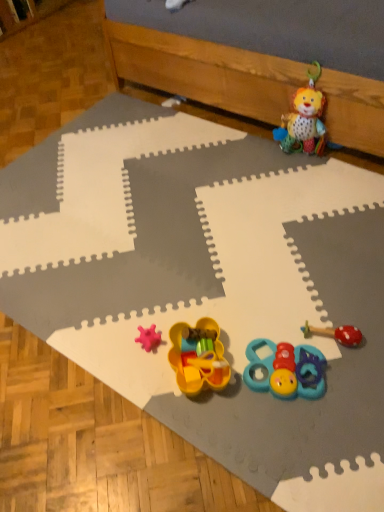
You are a GUI agent. You are given a task and a screenshot of the screen. Output one action in this format:
    pyautogui.click(x=<x>, y=<y>)
    Task: Click on the free space in front of plush fabric lion at upper right, which appears as the 4th toy when ordered from the bottom
    
    Given the screenshot: What is the action you would take?
    pyautogui.click(x=311, y=181)